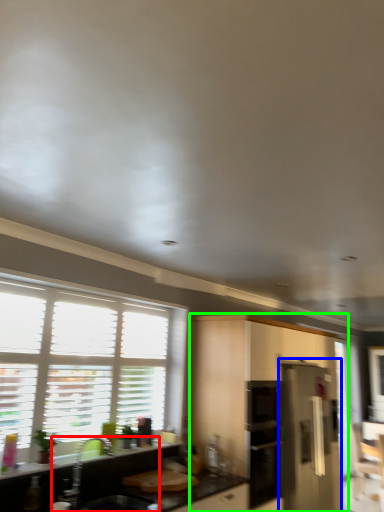
Question: Considering the real-world distances, which object is closest to sink (highlighted by a red box)? appliance (highlighted by a blue box) or cabinetry (highlighted by a green box).

Choices:
 (A) appliance
 (B) cabinetry

Answer: (B)